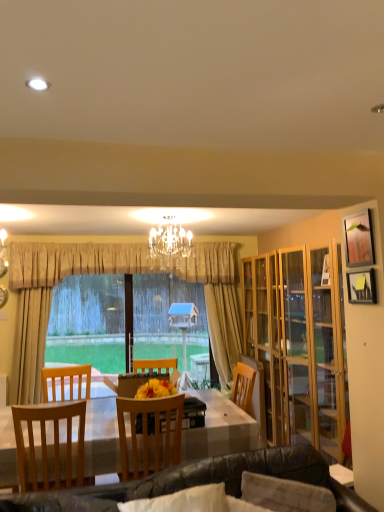
Question: Is leather couch at lower center a part of beige fabric curtain at center?

Choices:
 (A) no
 (B) yes

Answer: (A)

Question: Considering the relative sizes of beige fabric curtain at center and leather couch at lower center in the image provided, is beige fabric curtain at center bigger than leather couch at lower center?

Choices:
 (A) no
 (B) yes

Answer: (B)

Question: From a real-world perspective, is beige fabric curtain at center under leather couch at lower center?

Choices:
 (A) yes
 (B) no

Answer: (B)

Question: Is beige fabric curtain at center wider than leather couch at lower center?

Choices:
 (A) yes
 (B) no

Answer: (B)

Question: Can you confirm if beige fabric curtain at center is taller than leather couch at lower center?

Choices:
 (A) yes
 (B) no

Answer: (A)

Question: From a real-world perspective, is wooden table at center positioned above or below crystal chandelier at center?

Choices:
 (A) above
 (B) below

Answer: (B)

Question: In the image, is wooden table at center on the left side or the right side of crystal chandelier at center?

Choices:
 (A) right
 (B) left

Answer: (B)

Question: Considering the positions of point (203, 438) and point (153, 242), is point (203, 438) closer or farther from the camera than point (153, 242)?

Choices:
 (A) closer
 (B) farther

Answer: (A)

Question: In terms of height, does wooden table at center look taller or shorter compared to crystal chandelier at center?

Choices:
 (A) tall
 (B) short

Answer: (A)

Question: Would you say light brown wooden chair at left, the 1th chair from the left, is inside or outside beige fabric curtain at center?

Choices:
 (A) outside
 (B) inside

Answer: (A)

Question: In terms of size, does light brown wooden chair at left, the 2th chair when ordered from right to left, appear bigger or smaller than beige fabric curtain at center?

Choices:
 (A) big
 (B) small

Answer: (B)

Question: From a real-world perspective, is light brown wooden chair at left, the 2th chair when ordered from right to left, physically located above or below beige fabric curtain at center?

Choices:
 (A) below
 (B) above

Answer: (A)

Question: Is point (61, 403) positioned closer to the camera than point (175, 269)?

Choices:
 (A) farther
 (B) closer

Answer: (B)

Question: Considering the positions of beige fabric curtain at center and wooden picture frame at upper right, the 1th picture frame from the top, in the image, is beige fabric curtain at center bigger or smaller than wooden picture frame at upper right, the 1th picture frame from the top,?

Choices:
 (A) big
 (B) small

Answer: (A)

Question: In the image, is beige fabric curtain at center positioned in front of or behind wooden picture frame at upper right, the 1th picture frame from the top?

Choices:
 (A) behind
 (B) front

Answer: (A)